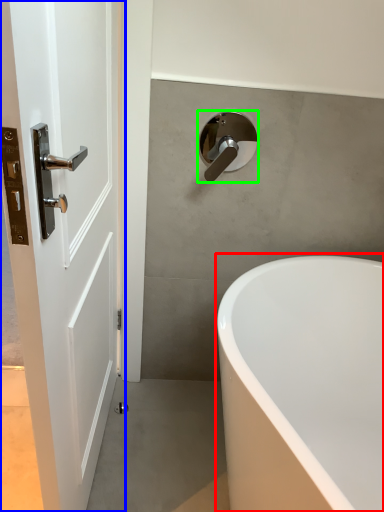
Question: Considering the real-world distances, which object is closest to bathtub (highlighted by a red box)? door (highlighted by a blue box) or tap (highlighted by a green box).

Choices:
 (A) door
 (B) tap

Answer: (A)